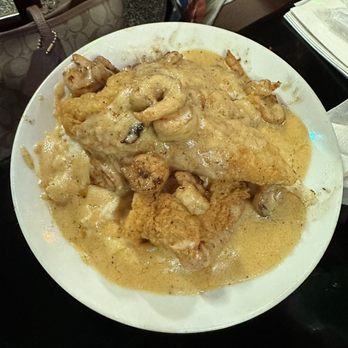
Identify the location of table. This screenshot has height=348, width=348. (30, 317).